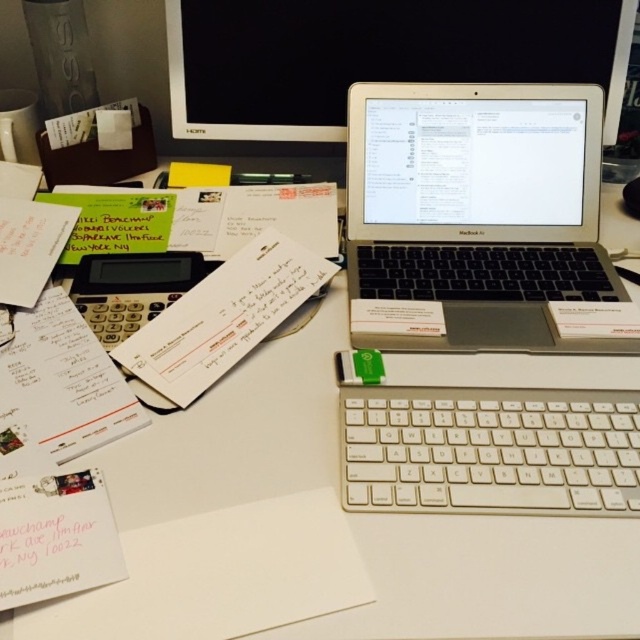
You are organizing a desk and need to place a new item at the point with coordinates point (374,56). According to the scene description, where exactly is this point located?

The point (374,56) is located on the satin black monitor at upper center.

You are sitting at the desk and want to reach for the silver metallic laptop at center and the white plastic keyboard at center. Which object is closer to you?

The silver metallic laptop at center is closer to you because it is positioned further to the viewer than the white plastic keyboard at center.

You are organizing your desk and need to know which item takes up more space. Based on the scene, which is larger in size between the silver metallic laptop at center and the satin black monitor at upper center?

The silver metallic laptop at center is bigger than the satin black monitor at upper center, so it takes up more space.